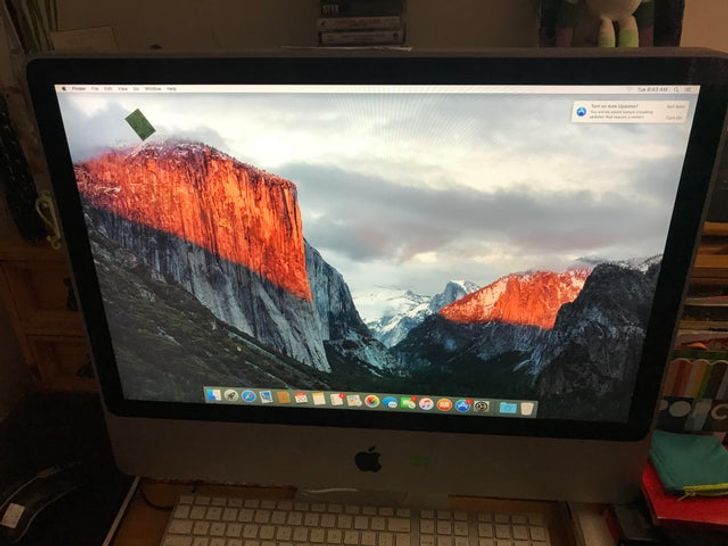
Find the location of `pencil holder`. pencil holder is located at coordinates (696, 461).